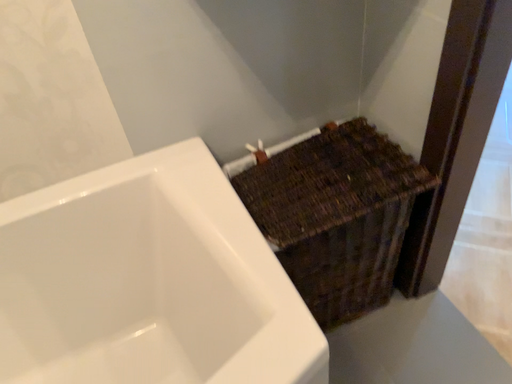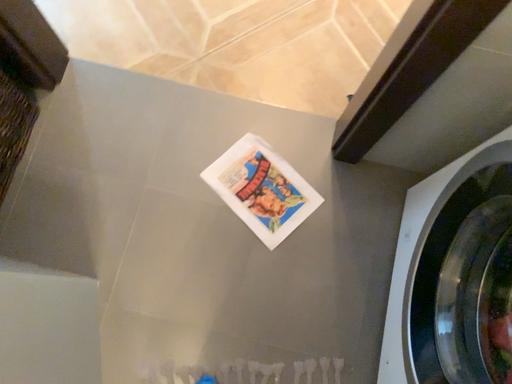
Question: Which way did the camera rotate in the video?

Choices:
 (A) rotated upward
 (B) rotated downward

Answer: (B)